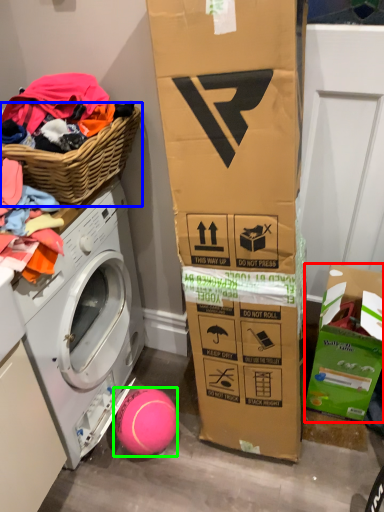
Question: Which object is positioned farthest from cardboard box (highlighted by a red box)? Select from basket (highlighted by a blue box) and ball (highlighted by a green box).

Choices:
 (A) basket
 (B) ball

Answer: (A)